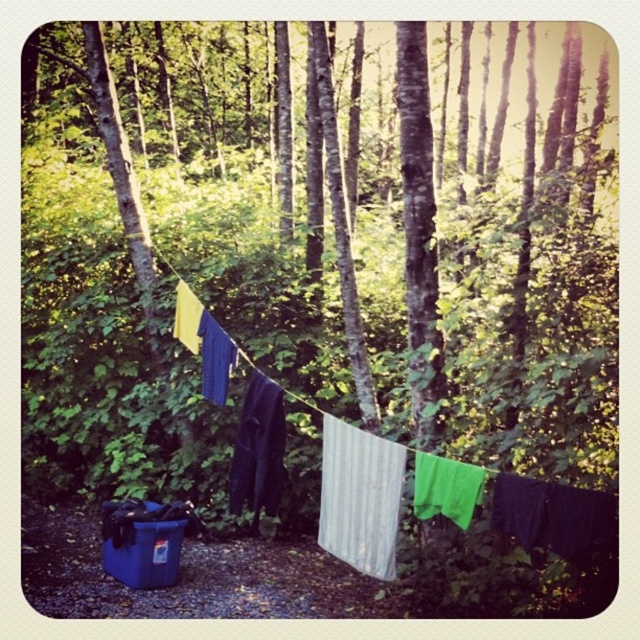
Question: Does blue plastic cooler at lower left have a lesser width compared to dark blue fabric at center?

Choices:
 (A) yes
 (B) no

Answer: (B)

Question: Is blue plastic cooler at lower left smaller than dark blue fabric at center?

Choices:
 (A) yes
 (B) no

Answer: (A)

Question: Which object is the farthest from the dark blue fabric at center?

Choices:
 (A) blue plastic cooler at lower left
 (B) white corrugated plastic at center

Answer: (A)

Question: Which point appears farthest from the camera in this image?

Choices:
 (A) coord(372,497)
 (B) coord(248,456)

Answer: (B)

Question: Among these objects, which one is farthest from the camera?

Choices:
 (A) dark blue fabric at center
 (B) blue plastic cooler at lower left
 (C) white corrugated plastic at center

Answer: (B)

Question: From the image, what is the correct spatial relationship of white corrugated plastic at center in relation to dark blue fabric at center?

Choices:
 (A) right
 (B) left

Answer: (A)